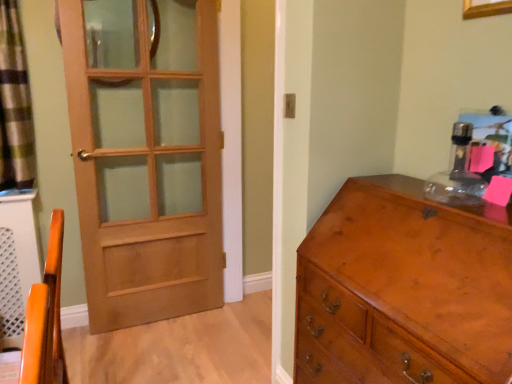
This screenshot has width=512, height=384. Describe the element at coordinates (145, 156) in the screenshot. I see `light brown wood door at left` at that location.

Identify the location of shiny brown wooden chest of drawers at right. (404, 289).

From the image's perspective, which object appears higher, shiny brown wooden chest of drawers at right or light brown wood door at left?

light brown wood door at left appears higher in the image.

Considering the sizes of objects shiny brown wooden chest of drawers at right and light brown wood door at left in the image provided, who is taller, shiny brown wooden chest of drawers at right or light brown wood door at left?

light brown wood door at left is taller.

How different are the orientations of shiny brown wooden chest of drawers at right and light brown wood door at left in degrees?

The angular difference between shiny brown wooden chest of drawers at right and light brown wood door at left is 89.1 degrees.

In the scene shown: Can you confirm if shiny brown wooden chest of drawers at right is wider than light brown wood door at left?

Correct, the width of shiny brown wooden chest of drawers at right exceeds that of light brown wood door at left.

Which object is thinner, shiny brown wooden chest of drawers at right or green plaid curtain at left?

green plaid curtain at left.

Can you confirm if shiny brown wooden chest of drawers at right is shorter than green plaid curtain at left?

No.

Which is less distant, (365, 181) or (8, 8)?

Point (365, 181).

Considering the relative positions of shiny brown wooden chest of drawers at right and green plaid curtain at left in the image provided, is shiny brown wooden chest of drawers at right to the right of green plaid curtain at left from the viewer's perspective?

Indeed, shiny brown wooden chest of drawers at right is positioned on the right side of green plaid curtain at left.

Who is taller, green plaid curtain at left or shiny brown wooden chest of drawers at right?

shiny brown wooden chest of drawers at right is taller.

Between green plaid curtain at left and shiny brown wooden chest of drawers at right, which one has larger width?

Wider between the two is shiny brown wooden chest of drawers at right.

From a real-world perspective, which object rests below the other?

In real-world perspective, shiny brown wooden chest of drawers at right is lower.

Is green plaid curtain at left oriented away from shiny brown wooden chest of drawers at right?

No, green plaid curtain at left is not facing the opposite direction of shiny brown wooden chest of drawers at right.

Where is `door that appears below the green plaid curtain at left (from a real-world perspective)`? door that appears below the green plaid curtain at left (from a real-world perspective) is located at coordinates (145, 156).

Is light brown wood door at left in front of or behind green plaid curtain at left in the image?

In the image, light brown wood door at left appears behind green plaid curtain at left.

From the picture: Does light brown wood door at left touch green plaid curtain at left?

light brown wood door at left is not next to green plaid curtain at left, and they're not touching.

Is light brown wood door at left turned away from green plaid curtain at left?

No, light brown wood door at left's orientation is not away from green plaid curtain at left.

Considering the positions of objects green plaid curtain at left and light brown wood door at left in the image provided, who is more to the right, green plaid curtain at left or light brown wood door at left?

Positioned to the right is light brown wood door at left.

Can you confirm if green plaid curtain at left is smaller than light brown wood door at left?

Correct, green plaid curtain at left occupies less space than light brown wood door at left.

Looking at their sizes, would you say green plaid curtain at left is wider or thinner than light brown wood door at left?

green plaid curtain at left is wider than light brown wood door at left.

Is light brown wood door at left turned away from shiny brown wooden chest of drawers at right?

No.

Considering the relative sizes of light brown wood door at left and shiny brown wooden chest of drawers at right in the image provided, is light brown wood door at left taller than shiny brown wooden chest of drawers at right?

Indeed, light brown wood door at left has a greater height compared to shiny brown wooden chest of drawers at right.

Does light brown wood door at left have a larger size compared to shiny brown wooden chest of drawers at right?

No.

The image size is (512, 384). In order to click on door located behind the shiny brown wooden chest of drawers at right in this screenshot , I will do `click(145, 156)`.

In the image, there is a green plaid curtain at left. Identify the location of the chest of drawers below it (from a real-world perspective). (404, 289).

Considering their positions, is shiny brown wooden chest of drawers at right positioned further to light brown wood door at left than green plaid curtain at left?

shiny brown wooden chest of drawers at right lies further to light brown wood door at left than the other object.

Based on their spatial positions, is green plaid curtain at left or shiny brown wooden chest of drawers at right further from light brown wood door at left?

shiny brown wooden chest of drawers at right lies further to light brown wood door at left than the other object.

Looking at the image, which one is located further to shiny brown wooden chest of drawers at right, light brown wood door at left or green plaid curtain at left?

Among the two, green plaid curtain at left is located further to shiny brown wooden chest of drawers at right.

Looking at the image, which one is located closer to shiny brown wooden chest of drawers at right, green plaid curtain at left or light brown wood door at left?

Based on the image, light brown wood door at left appears to be nearer to shiny brown wooden chest of drawers at right.

From the image, which object appears to be nearer to green plaid curtain at left, shiny brown wooden chest of drawers at right or light brown wood door at left?

Based on the image, light brown wood door at left appears to be nearer to green plaid curtain at left.

Based on their spatial positions, is light brown wood door at left or shiny brown wooden chest of drawers at right further from green plaid curtain at left?

shiny brown wooden chest of drawers at right.

The width and height of the screenshot is (512, 384). Find the location of `door between green plaid curtain at left and shiny brown wooden chest of drawers at right from left to right`. door between green plaid curtain at left and shiny brown wooden chest of drawers at right from left to right is located at coordinates (145, 156).